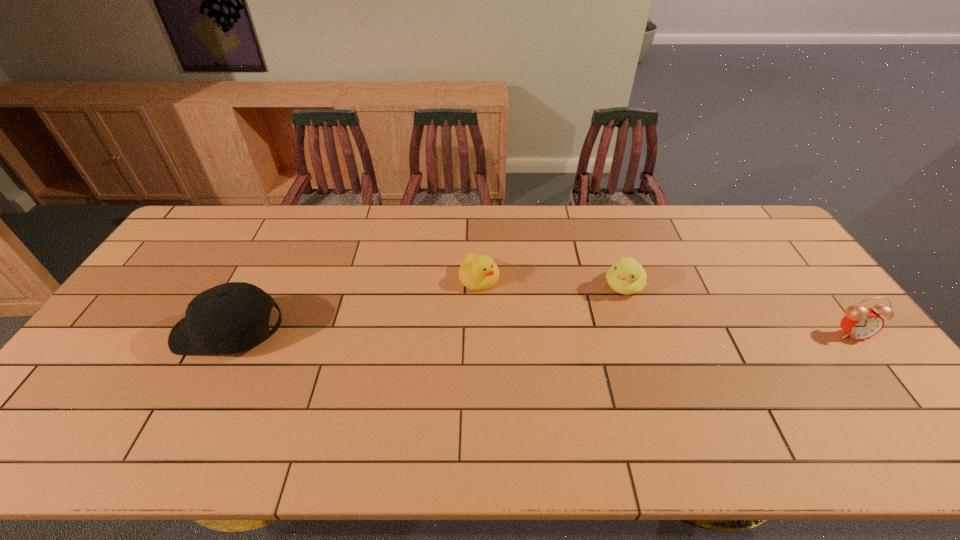
Image resolution: width=960 pixels, height=540 pixels. I want to click on vacant area between the leftmost object and the rightmost object, so click(x=540, y=333).

You are a GUI agent. You are given a task and a screenshot of the screen. Output one action in this format:
    pyautogui.click(x=<x>, y=<y>)
    Task: Click on the empty location between the leftmost object and the rightmost object
    The height and width of the screenshot is (540, 960).
    Given the screenshot: What is the action you would take?
    pyautogui.click(x=540, y=333)

At what (x,y) coordinates should I click in order to perform the action: click on free space between the rightmost object and the second object from right to left. Please return your answer as a coordinate pair (x, y). The width and height of the screenshot is (960, 540). Looking at the image, I should click on (737, 309).

At what (x,y) coordinates should I click in order to perform the action: click on vacant point located between the rightmost object and the third object from left to right. Please return your answer as a coordinate pair (x, y). This screenshot has width=960, height=540. Looking at the image, I should click on (737, 309).

Find the location of `free space between the alarm clock and the leftmost object`. free space between the alarm clock and the leftmost object is located at coordinates (540, 333).

Find the location of a particular element. The image size is (960, 540). free spot between the rightmost object and the leftmost object is located at coordinates (540, 333).

At what (x,y) coordinates should I click in order to perform the action: click on free space between the baseball cap and the shortest object. Please return your answer as a coordinate pair (x, y). The height and width of the screenshot is (540, 960). Looking at the image, I should click on (354, 305).

Locate an element on the screen. vacant space that is in between the rightmost object and the right duckling is located at coordinates (737, 309).

Image resolution: width=960 pixels, height=540 pixels. I want to click on unoccupied area between the rightmost object and the right duckling, so click(x=737, y=309).

Locate an element on the screen. The height and width of the screenshot is (540, 960). free spot between the second object from right to left and the alarm clock is located at coordinates (737, 309).